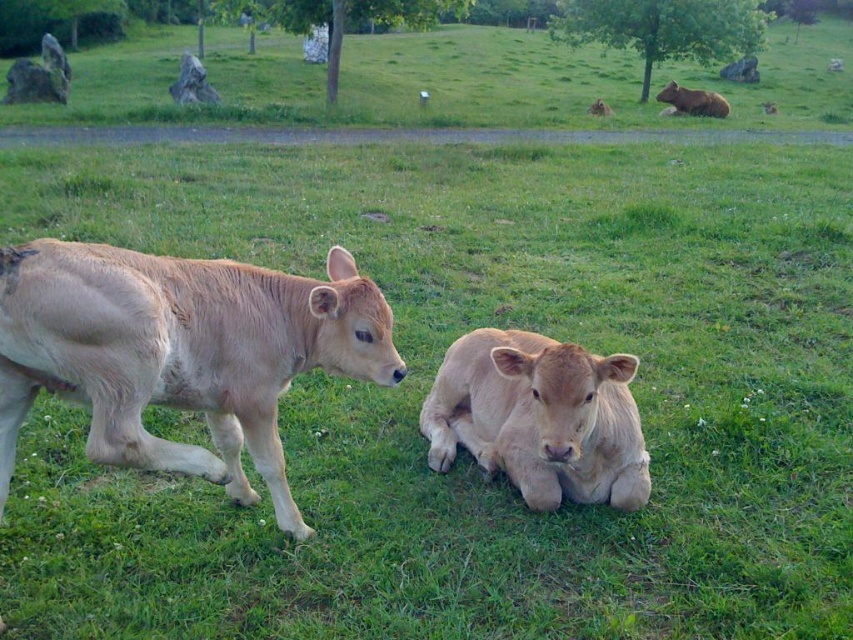
Question: Which of these objects is positioned closest to the brown furry bear at upper right?

Choices:
 (A) light brown fur at center
 (B) brown furry cow at upper right

Answer: (B)

Question: Considering the relative positions of light brown fur at center and brown furry cow at upper right in the image provided, where is light brown fur at center located with respect to brown furry cow at upper right?

Choices:
 (A) right
 (B) left

Answer: (B)

Question: Is light brown fur at left wider than brown furry bear at upper right?

Choices:
 (A) yes
 (B) no

Answer: (B)

Question: Among these points, which one is nearest to the camera?

Choices:
 (A) (596, 100)
 (B) (669, 97)
 (C) (242, 477)

Answer: (C)

Question: Does light brown fur at left appear on the left side of light brown fur at center?

Choices:
 (A) yes
 (B) no

Answer: (A)

Question: Considering the real-world distances, which object is closest to the light brown fur at center?

Choices:
 (A) brown furry bear at upper right
 (B) brown furry cow at upper right

Answer: (B)